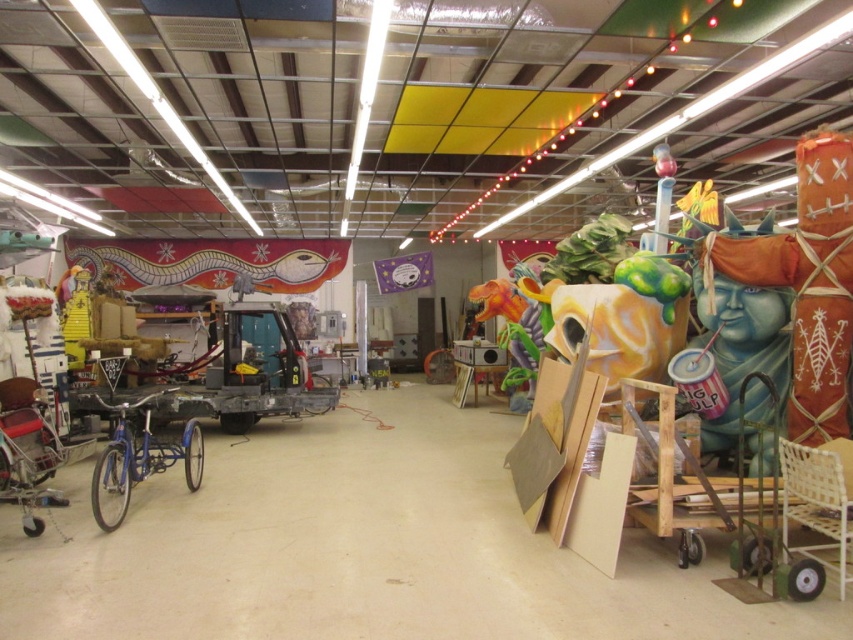
Based on the photo, you are organizing a childrens event and need to place a 1.2 meter wide table between the blue painted statue at right and the shiny blue bicycle at lower left. Can the table fit between them?

The blue painted statue at right is narrower than the shiny blue bicycle at lower left. However, the exact distance between them isn t specified in the objects description. Without knowing the actual spacing between the two objects, we can t determine if the table will fit. More information about their positioning is needed.

You are organizing a community event and need to transport both the blue painted statue at right and the shiny blue bicycle at lower left. Which object requires a larger vehicle to transport?

The blue painted statue at right requires a larger vehicle to transport because it is larger in size than the shiny blue bicycle at lower left.